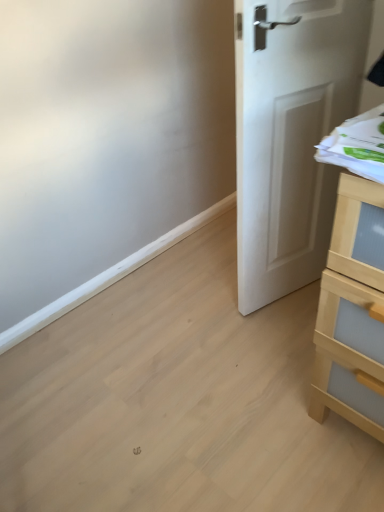
You are a GUI agent. You are given a task and a screenshot of the screen. Output one action in this format:
    pyautogui.click(x=<x>, y=<y>)
    Task: Click on the free area below white matte door at center (from a real-world perspective)
    The height and width of the screenshot is (512, 384).
    Given the screenshot: What is the action you would take?
    pyautogui.click(x=296, y=294)